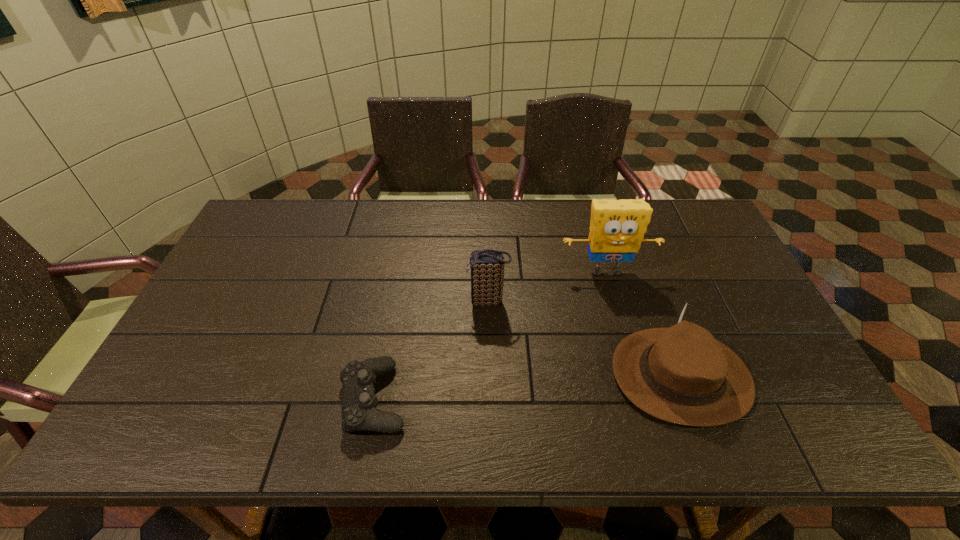
Find the location of a particular element. vacant position at the near edge of the desktop is located at coordinates (596, 446).

Locate an element on the screen. The width and height of the screenshot is (960, 540). free point at the left edge is located at coordinates (170, 357).

Identify the location of blank space at the far left corner of the desktop. The width and height of the screenshot is (960, 540). (292, 205).

In the image, there is a desktop. At what (x,y) coordinates should I click in order to perform the action: click on blank space at the near left corner. Please return your answer as a coordinate pair (x, y). Looking at the image, I should click on (200, 417).

I want to click on vacant space that's between the fedora and the control, so click(527, 387).

At what (x,y) coordinates should I click in order to perform the action: click on blank region between the leftmost object and the third nearest object. Please return your answer as a coordinate pair (x, y). This screenshot has width=960, height=540. Looking at the image, I should click on (431, 350).

In order to click on empty location between the second farthest object and the sponge in this screenshot , I will do `click(547, 287)`.

You are a GUI agent. You are given a task and a screenshot of the screen. Output one action in this format:
    pyautogui.click(x=<x>, y=<y>)
    Task: Click on the empty location between the second shortest object and the third shortest object
    The image size is (960, 540).
    Given the screenshot: What is the action you would take?
    pyautogui.click(x=585, y=339)

Find the location of a particular element. This screenshot has width=960, height=540. free spot between the leftmost object and the tallest object is located at coordinates (491, 335).

Where is `vacant space that's between the leftmost object and the tallest object`? Image resolution: width=960 pixels, height=540 pixels. vacant space that's between the leftmost object and the tallest object is located at coordinates (491, 335).